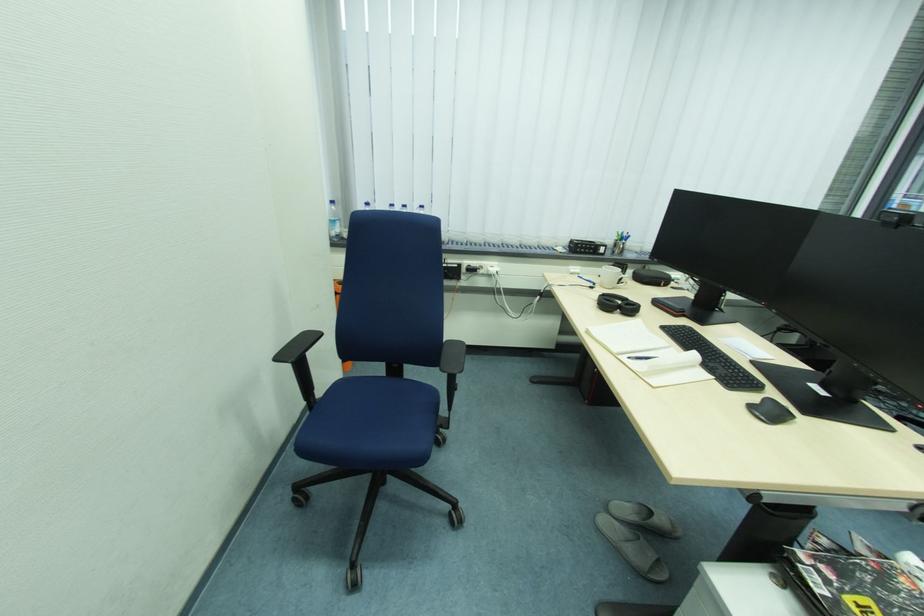
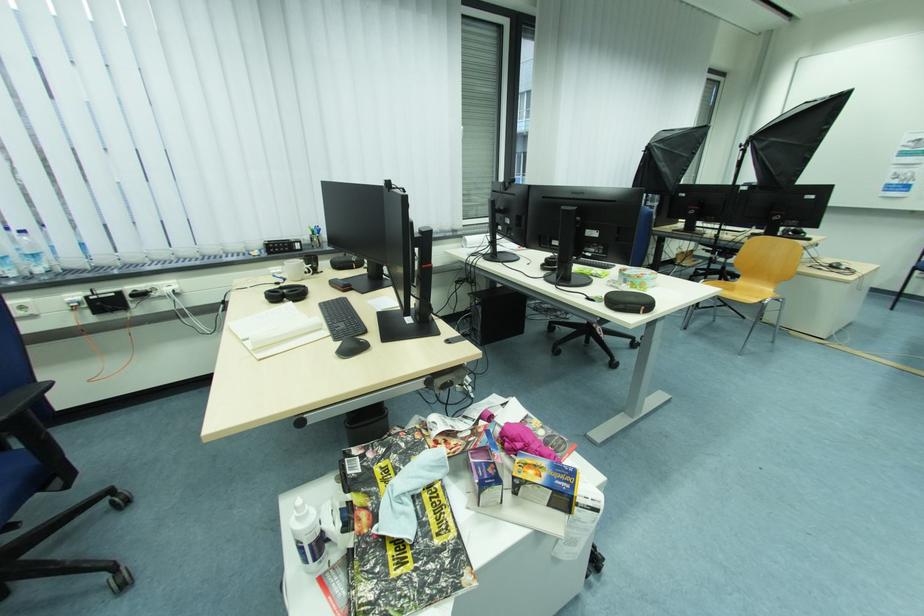
In the second image, find the point that corresponds to pixel 622 241 in the first image.

(318, 236)